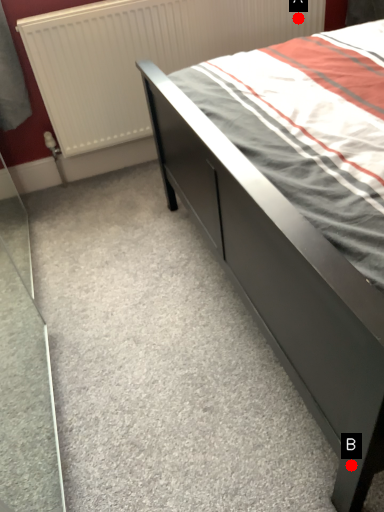
Question: Two points are circled on the image, labeled by A and B beside each circle. Which of the following is the closest to the observer?

Choices:
 (A) A is closer
 (B) B is closer

Answer: (B)